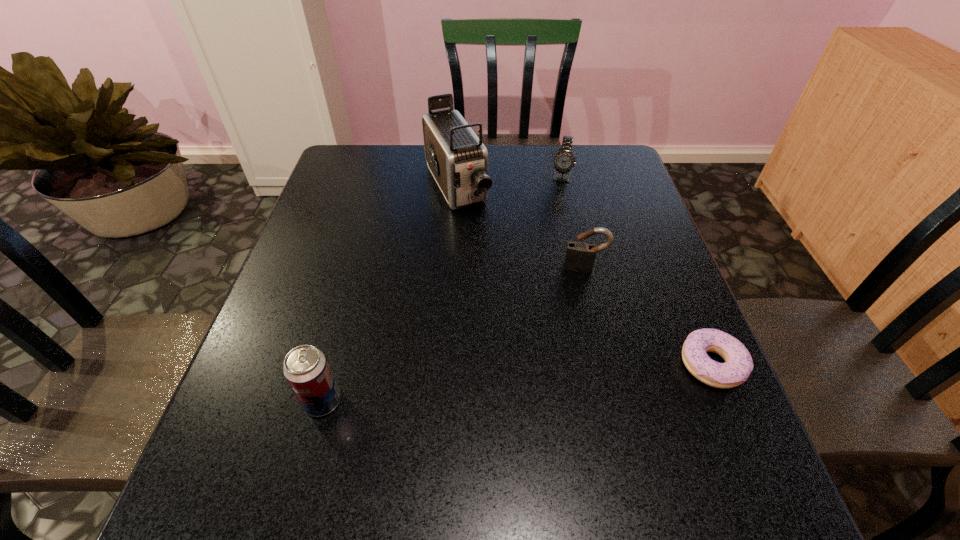
What are the coordinates of `vacant space at the near right corner of the desktop` in the screenshot? It's located at (713, 409).

In order to click on free spot between the rightmost object and the beer can in this screenshot , I will do `click(517, 383)`.

You are a GUI agent. You are given a task and a screenshot of the screen. Output one action in this format:
    pyautogui.click(x=<x>, y=<y>)
    Task: Click on the vacant space that is in between the third nearest object and the leftmost object
    The width and height of the screenshot is (960, 540).
    Given the screenshot: What is the action you would take?
    pyautogui.click(x=453, y=334)

Where is `free spot between the camcorder and the watch`? The image size is (960, 540). free spot between the camcorder and the watch is located at coordinates (509, 182).

Find the location of a particular element. Image resolution: width=960 pixels, height=540 pixels. free space between the watch and the third nearest object is located at coordinates (572, 222).

In order to click on vacant area that lies between the third farthest object and the second object from left to right in this screenshot , I will do `click(520, 227)`.

Find the location of a particular element. free area in between the watch and the third nearest object is located at coordinates (572, 222).

Find the location of a particular element. This screenshot has width=960, height=540. blank region between the doughnut and the leftmost object is located at coordinates (517, 383).

The height and width of the screenshot is (540, 960). In order to click on vacant area that lies between the beer can and the tallest object in this screenshot , I will do point(390,294).

Image resolution: width=960 pixels, height=540 pixels. Identify the location of free point between the camcorder and the padlock. (520, 227).